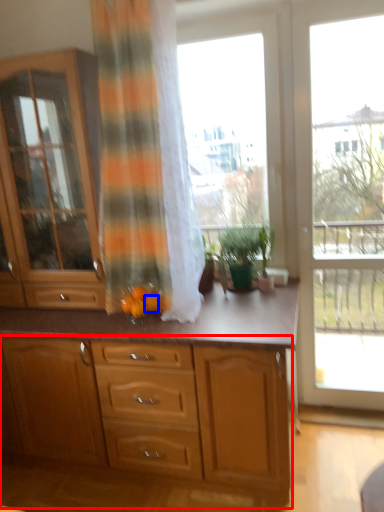
Question: Which object appears farthest to the camera in this image, cabinetry (highlighted by a red box) or tangerine (highlighted by a blue box)?

Choices:
 (A) cabinetry
 (B) tangerine

Answer: (B)